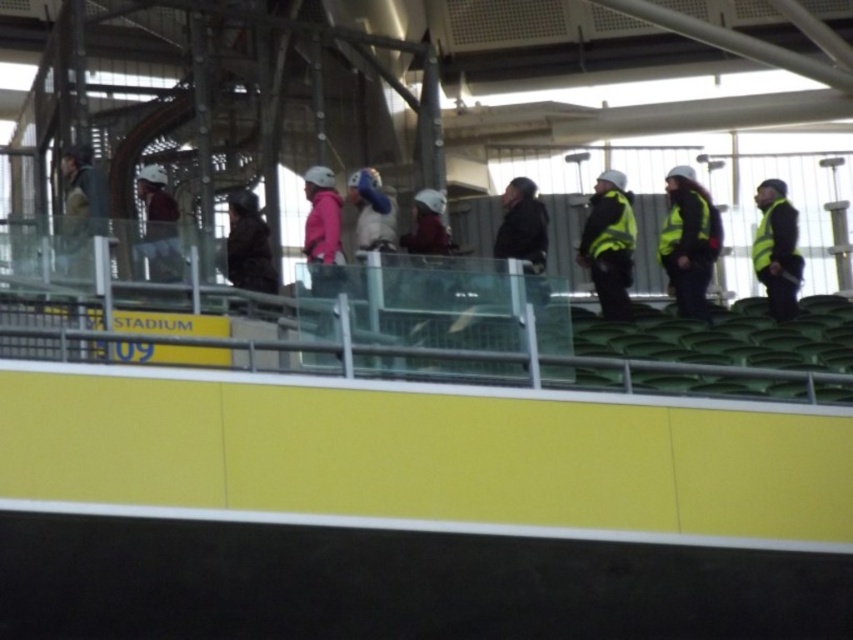
Question: Can you confirm if high-visibility yellow vest at center is positioned to the left of dark brown leather jacket at center?

Choices:
 (A) no
 (B) yes

Answer: (A)

Question: Which object is positioned closest to the yellow reflective vest at right?

Choices:
 (A) yellow reflective vest at center
 (B) high-visibility yellow vest at center

Answer: (A)

Question: Does yellow reflective vest at center have a smaller size compared to high-visibility yellow vest at center?

Choices:
 (A) no
 (B) yes

Answer: (A)

Question: Is yellow reflective vest at center to the right of high-visibility yellow vest at center from the viewer's perspective?

Choices:
 (A) yes
 (B) no

Answer: (A)

Question: Estimate the real-world distances between objects in this image. Which object is closer to the yellow reflective vest at center?

Choices:
 (A) high-visibility yellow vest at center
 (B) yellow reflective vest at right
 (C) dark brown leather jacket at center

Answer: (A)

Question: Which is farther from the dark brown leather jacket at center?

Choices:
 (A) yellow reflective vest at right
 (B) high-visibility yellow vest at center
 (C) yellow reflective vest at center

Answer: (A)